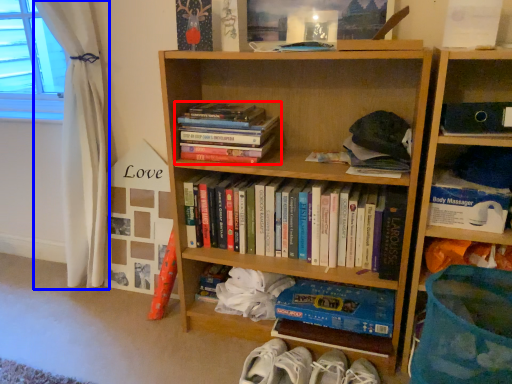
Question: Which of the following is the closest to the observer, book (highlighted by a red box) or curtain (highlighted by a blue box)?

Choices:
 (A) book
 (B) curtain

Answer: (A)